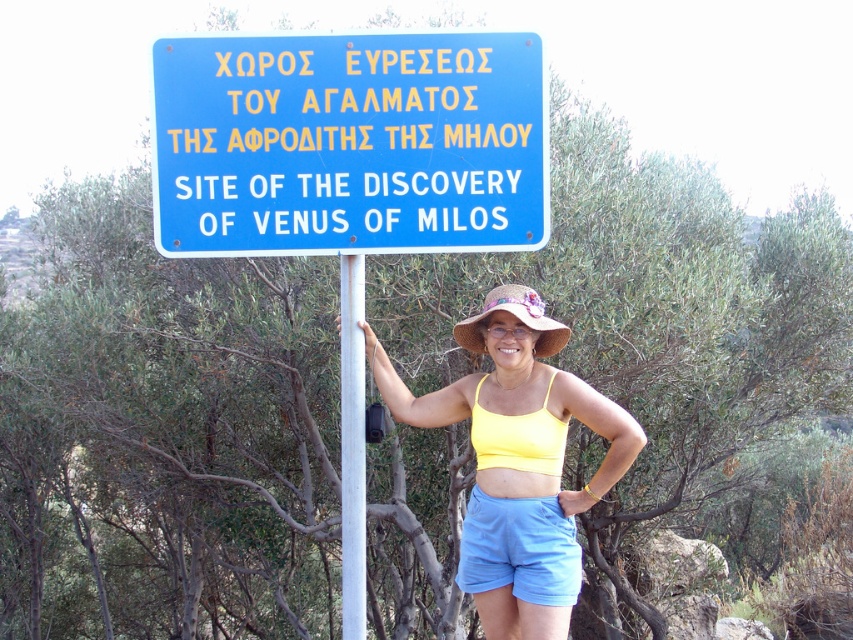
Does point (556, 513) come closer to viewer compared to point (508, 557)?

Yes, point (556, 513) is closer to viewer.

The height and width of the screenshot is (640, 853). Identify the location of yellow fabric top at center. (518, 460).

Find the location of a particular element. This screenshot has height=640, width=853. yellow fabric top at center is located at coordinates (518, 460).

Is blue metallic sign at center positioned in front of light blue fabric shorts at center?

Yes, it is in front of light blue fabric shorts at center.

Does blue metallic sign at center appear on the left side of light blue fabric shorts at center?

Indeed, blue metallic sign at center is positioned on the left side of light blue fabric shorts at center.

Between point (257, 65) and point (494, 552), which one is positioned in front?

Point (257, 65) is in front.

Where is `blue metallic sign at center`? This screenshot has height=640, width=853. blue metallic sign at center is located at coordinates (347, 144).

Is yellow fabric top at center bigger than white metallic pole at center?

Yes, yellow fabric top at center is bigger than white metallic pole at center.

Is yellow fabric top at center positioned behind white metallic pole at center?

That is True.

Image resolution: width=853 pixels, height=640 pixels. Identify the location of yellow fabric top at center. (518, 460).